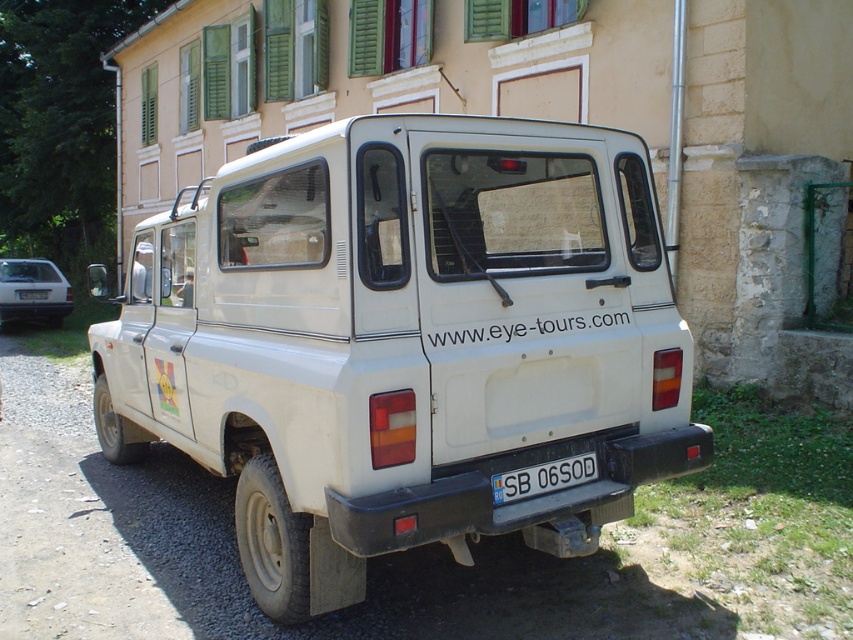
Between white matte pickup truck at center and white plastic license plate at rear, which one is positioned higher?

white plastic license plate at rear is higher up.

Which is more to the right, white matte pickup truck at center or white plastic license plate at rear?

Positioned to the right is white matte pickup truck at center.

The width and height of the screenshot is (853, 640). I want to click on white matte pickup truck at center, so (x=404, y=342).

Is white matte pickup truck at center to the right of silver metallic sedan at left from the viewer's perspective?

Indeed, white matte pickup truck at center is positioned on the right side of silver metallic sedan at left.

Between point (520, 280) and point (19, 264), which one is positioned behind?

The point (19, 264) is more distant.

The height and width of the screenshot is (640, 853). Describe the element at coordinates (404, 342) in the screenshot. I see `white matte pickup truck at center` at that location.

The image size is (853, 640). What are the coordinates of `white matte pickup truck at center` in the screenshot? It's located at (404, 342).

Between white matte pickup truck at center and white plastic license plate at lower center, which one has less height?

With less height is white plastic license plate at lower center.

Does point (643, 272) come in front of point (515, 493)?

No, (643, 272) is further to viewer.

Where is `white matte pickup truck at center`? This screenshot has width=853, height=640. white matte pickup truck at center is located at coordinates (404, 342).